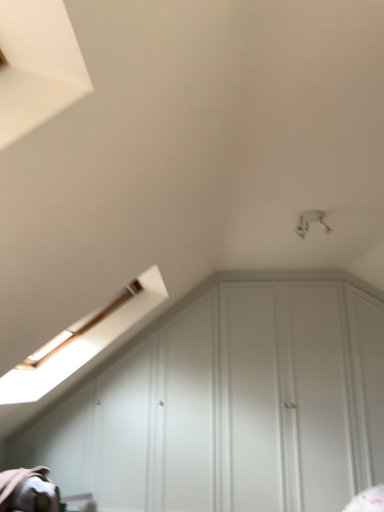
Question: Is point (301, 222) closer or farther from the camera than point (183, 507)?

Choices:
 (A) closer
 (B) farther

Answer: (A)

Question: From the image's perspective, is white glossy light fixture at upper right located above or below white matte cabinet at lower center?

Choices:
 (A) below
 (B) above

Answer: (B)

Question: Is white glossy light fixture at upper right taller or shorter than white matte cabinet at lower center?

Choices:
 (A) tall
 (B) short

Answer: (B)

Question: Is point coord(377,344) positioned closer to the camera than point coord(304,222)?

Choices:
 (A) closer
 (B) farther

Answer: (B)

Question: From a real-world perspective, is white matte cabinet at lower center above or below white glossy light fixture at upper right?

Choices:
 (A) above
 (B) below

Answer: (B)

Question: From the image's perspective, is white matte cabinet at lower center located above or below white glossy light fixture at upper right?

Choices:
 (A) below
 (B) above

Answer: (A)

Question: In terms of width, does white matte cabinet at lower center look wider or thinner when compared to white glossy light fixture at upper right?

Choices:
 (A) thin
 (B) wide

Answer: (A)